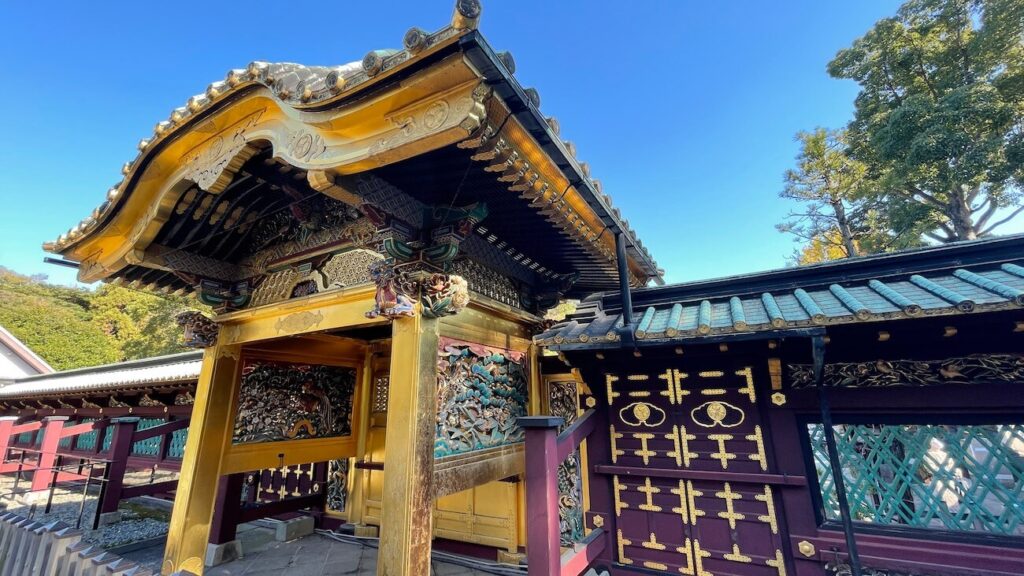
Identify the location of gold emblem on door. (641, 413), (710, 414).